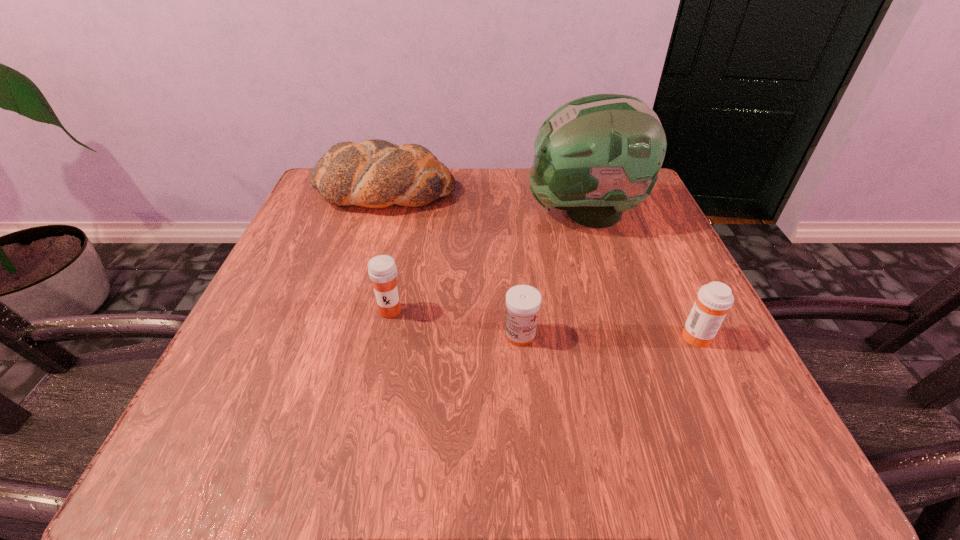
You are a GUI agent. You are given a task and a screenshot of the screen. Output one action in this format:
    pyautogui.click(x=<x>, y=<y>)
    Task: Click on the empty location between the rightmost medicine and the tallest object
    
    Given the screenshot: What is the action you would take?
    pyautogui.click(x=640, y=274)

The image size is (960, 540). Find the location of `vacant region between the bread and the rightmost medicine`. vacant region between the bread and the rightmost medicine is located at coordinates (540, 264).

The width and height of the screenshot is (960, 540). I want to click on free point between the football helmet and the bread, so [x=484, y=203].

Where is `vacant area that lies between the tallest object and the rightmost medicine`? This screenshot has width=960, height=540. vacant area that lies between the tallest object and the rightmost medicine is located at coordinates (640, 274).

Image resolution: width=960 pixels, height=540 pixels. In order to click on vacant area between the rightmost medicine and the bread in this screenshot , I will do pyautogui.click(x=540, y=264).

The width and height of the screenshot is (960, 540). Find the location of `the fourth closest object to the rightmost medicine`. the fourth closest object to the rightmost medicine is located at coordinates (375, 173).

Identify the location of the third closest object to the leftmost medicine. (596, 156).

This screenshot has height=540, width=960. I want to click on medicine that is the second closest to the bread, so click(523, 302).

This screenshot has width=960, height=540. In order to click on the closest medicine to the football helmet in this screenshot , I will do `click(523, 302)`.

Where is `free region that satisfies the following two spatial constraints: 1. on the label side of the rightmost medicine; 2. on the right side of the leftmost medicine`? Image resolution: width=960 pixels, height=540 pixels. free region that satisfies the following two spatial constraints: 1. on the label side of the rightmost medicine; 2. on the right side of the leftmost medicine is located at coordinates (385, 335).